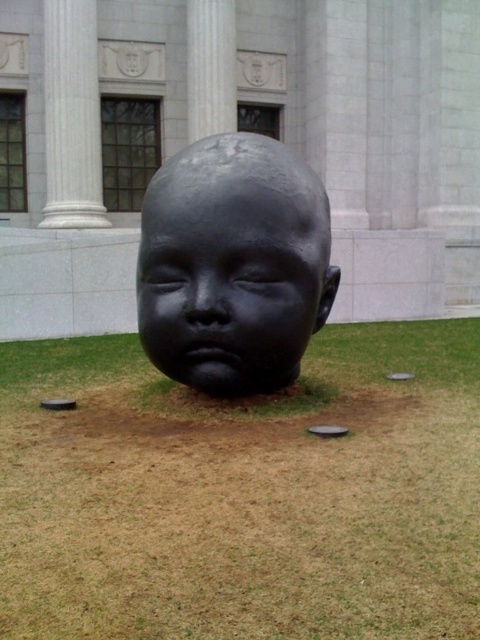
Question: Does white marble column at upper left have a larger size compared to white marble pillar at center?

Choices:
 (A) no
 (B) yes

Answer: (B)

Question: Does black polished stone head at center come in front of white marble pillar at center?

Choices:
 (A) no
 (B) yes

Answer: (B)

Question: Which object is closer to the camera taking this photo?

Choices:
 (A) black polished stone head at center
 (B) white marble column at upper left
 (C) white marble pillar at center
 (D) black matte sculpture at center

Answer: (D)

Question: Which object appears closest to the camera in this image?

Choices:
 (A) green grass at center
 (B) black polished stone head at center
 (C) white marble column at upper left
 (D) white marble pillar at center

Answer: (A)

Question: Is green grass at center positioned behind black matte sculpture at center?

Choices:
 (A) yes
 (B) no

Answer: (B)

Question: Which of the following is the farthest from the observer?

Choices:
 (A) (458, 484)
 (B) (280, 326)
 (C) (71, 188)

Answer: (C)